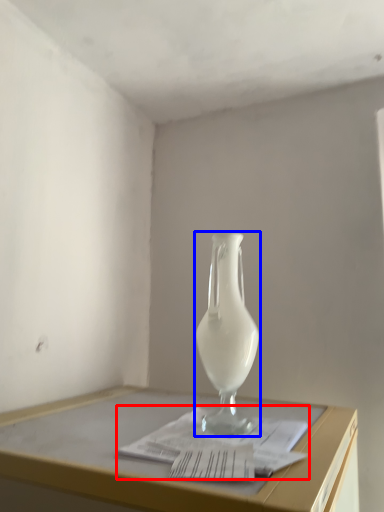
Question: Which object is closer to the camera taking this photo, magazine (highlighted by a red box) or vase (highlighted by a blue box)?

Choices:
 (A) magazine
 (B) vase

Answer: (A)